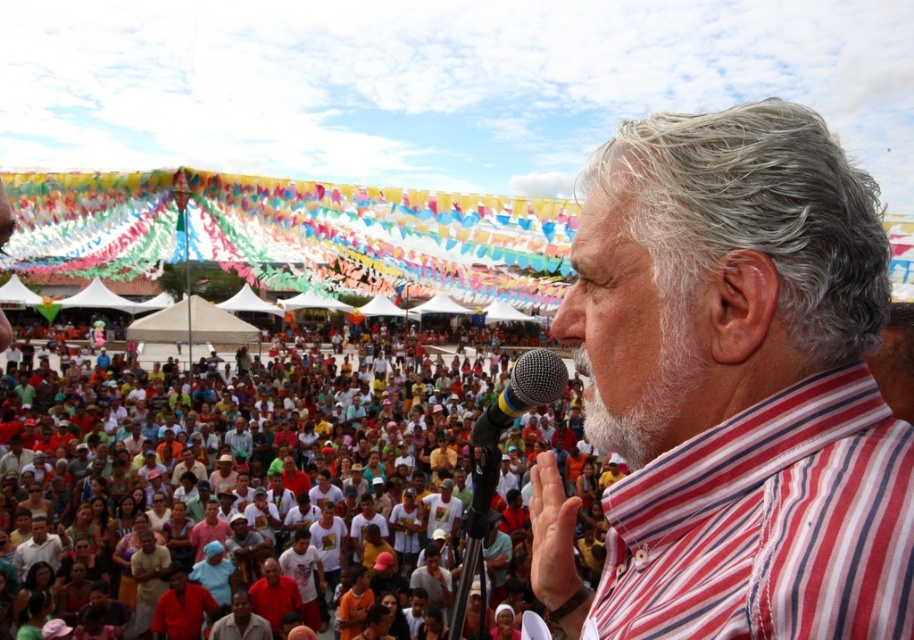
Which is above, striped cotton shirt at center or multicolored plastic microphone at center?

striped cotton shirt at center is higher up.

Who is more forward, (716, 541) or (490, 412)?

Point (716, 541)

Who is more distant from viewer, (853, 500) or (491, 440)?

The point (491, 440) is more distant.

Locate an element on the screen. The width and height of the screenshot is (914, 640). striped cotton shirt at center is located at coordinates (732, 388).

Does multicolored fabric crowd at center appear on the right side of multicolored plastic microphone at center?

Incorrect, multicolored fabric crowd at center is not on the right side of multicolored plastic microphone at center.

Which is below, multicolored fabric crowd at center or multicolored plastic microphone at center?

multicolored plastic microphone at center is lower down.

You are a GUI agent. You are given a task and a screenshot of the screen. Output one action in this format:
    pyautogui.click(x=<x>, y=<y>)
    Task: Click on the multicolored fabric crowd at center
    This screenshot has height=640, width=914.
    Given the screenshot: What is the action you would take?
    tap(262, 483)

Image resolution: width=914 pixels, height=640 pixels. I want to click on multicolored fabric crowd at center, so click(262, 483).

The height and width of the screenshot is (640, 914). In order to click on striped cotton shirt at center in this screenshot , I will do `click(732, 388)`.

Describe the element at coordinates (732, 388) in the screenshot. This screenshot has width=914, height=640. I see `striped cotton shirt at center` at that location.

Which is in front, point (771, 259) or point (796, 572)?

Point (796, 572)

The height and width of the screenshot is (640, 914). What are the coordinates of `striped cotton shirt at center` in the screenshot? It's located at (732, 388).